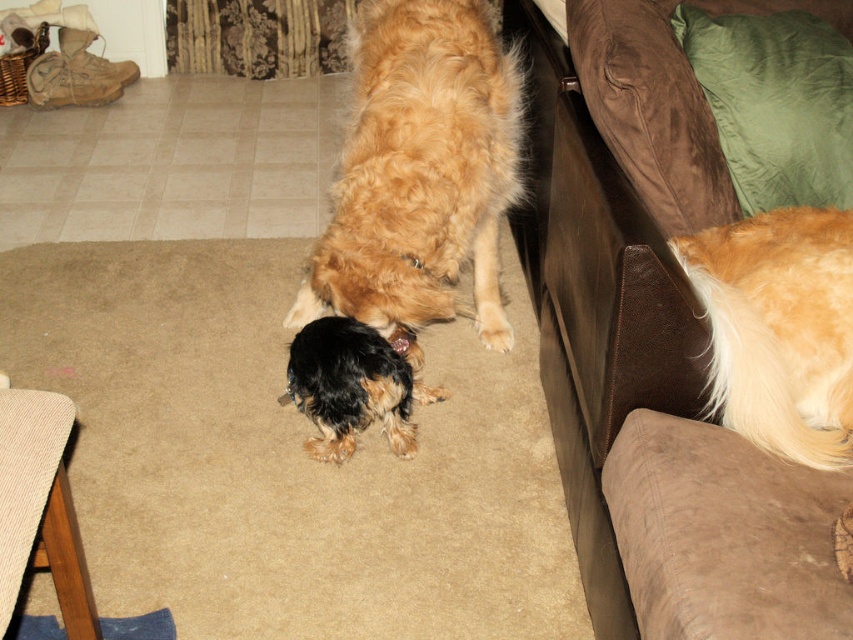
Measure the distance between golden fur dog at center and camera.

golden fur dog at center is 5.77 feet away from camera.

Does golden fur dog at center have a lesser height compared to golden fur dog at right?

Incorrect, golden fur dog at center's height does not fall short of golden fur dog at right's.

Looking at this image, measure the distance between golden fur dog at center and camera.

golden fur dog at center and camera are 5.77 feet apart from each other.

Where is `golden fur dog at center`? The image size is (853, 640). golden fur dog at center is located at coordinates (421, 170).

Who is shorter, brown suede couch at right or golden fur dog at center?

With less height is golden fur dog at center.

Does point (605, 243) lie behind point (461, 172)?

No.

Is point (641, 336) closer to camera compared to point (428, 221)?

Yes, it is in front of point (428, 221).

You are a GUI agent. You are given a task and a screenshot of the screen. Output one action in this format:
    pyautogui.click(x=<x>, y=<y>)
    Task: Click on the brown suede couch at right
    
    Given the screenshot: What is the action you would take?
    pyautogui.click(x=596, y=307)

Can you confirm if golden fur dog at center is wider than shiny black fur at center?

Correct, the width of golden fur dog at center exceeds that of shiny black fur at center.

Looking at this image, which is more to the right, golden fur dog at center or shiny black fur at center?

Positioned to the right is golden fur dog at center.

Where is `golden fur dog at center`? The height and width of the screenshot is (640, 853). golden fur dog at center is located at coordinates (421, 170).

The image size is (853, 640). I want to click on golden fur dog at center, so click(421, 170).